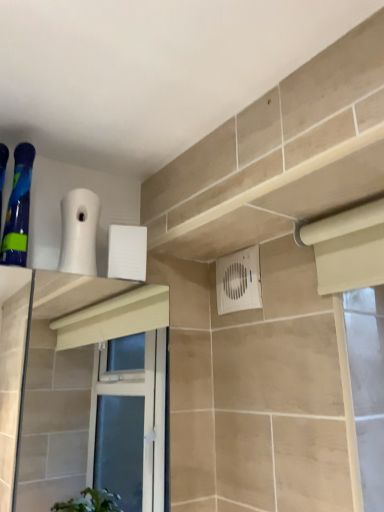
Question: In which direction should I rotate to look at white plastic air conditioning unit at center?

Choices:
 (A) left
 (B) right

Answer: (B)